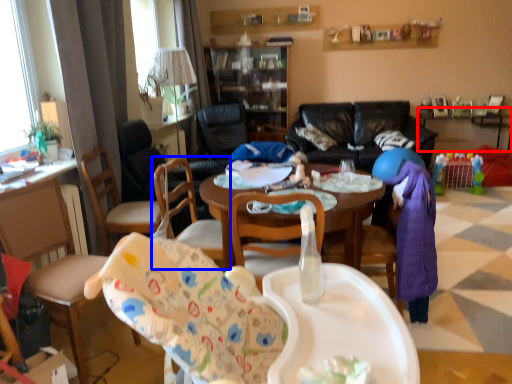
Question: Which object is closer to the camera taking this photo, table (highlighted by a red box) or chair (highlighted by a blue box)?

Choices:
 (A) table
 (B) chair

Answer: (B)